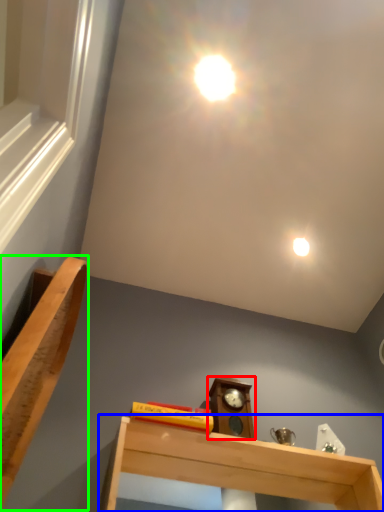
Question: Which is farther away from alarm clock (highlighted by a red box)? shelf (highlighted by a blue box) or furniture (highlighted by a green box)?

Choices:
 (A) shelf
 (B) furniture

Answer: (B)